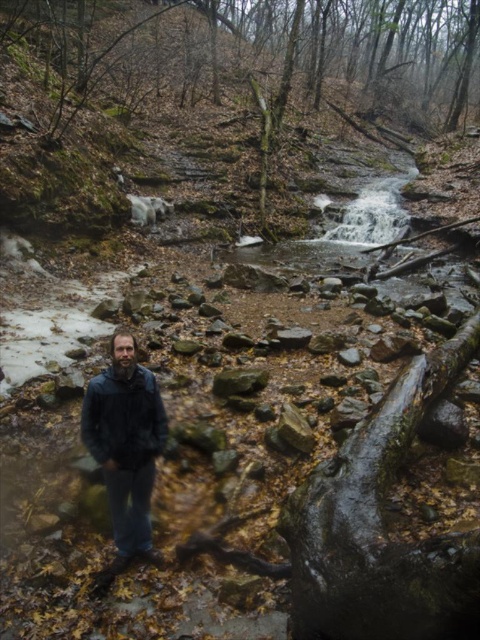
You are a hiker who wants to take a photo of both the dark blue jacket at center and the dark blue leather jacket at lower left. Since you only have one camera, you need to position yourself in a way that both jackets are visible in the frame. Based on their sizes, which jacket should you focus on first to ensure both are in the shot?

The dark blue jacket at center is much taller than the dark blue leather jacket at lower left, so you should focus on including the larger jacket first in your frame to ensure both are visible.

You are a hiker trying to decide which jacket to wear for the day. You see the dark blue jacket at center and the dark blue leather jacket at lower left. Which one is narrower?

The dark blue jacket at center is narrower than the dark blue leather jacket at lower left.